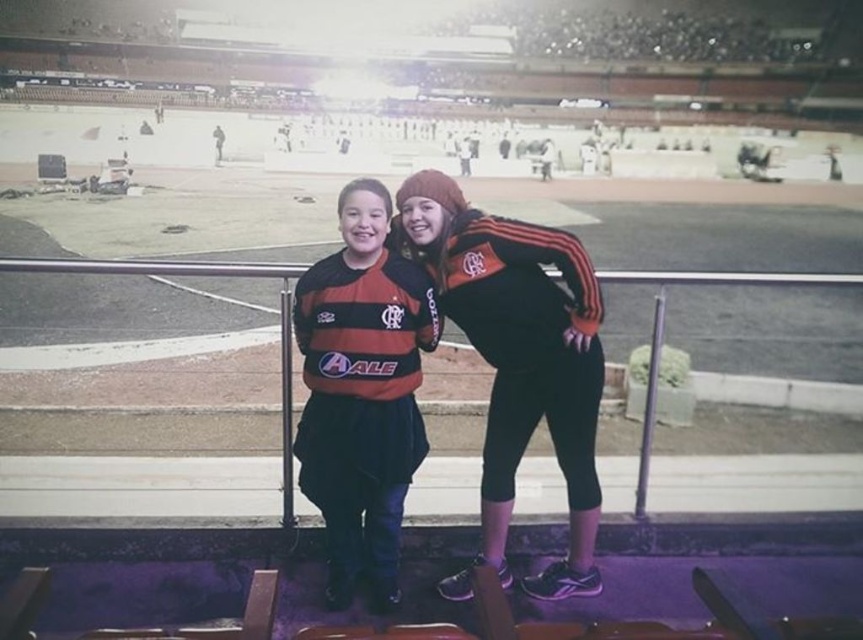
Which is in front, point (508, 513) or point (351, 520)?

Point (351, 520)

Between point (501, 580) and point (356, 547), which one is positioned behind?

The point (356, 547) is more distant.

Find the location of a particular element. This screenshot has width=863, height=640. black matte jacket at center is located at coordinates (518, 356).